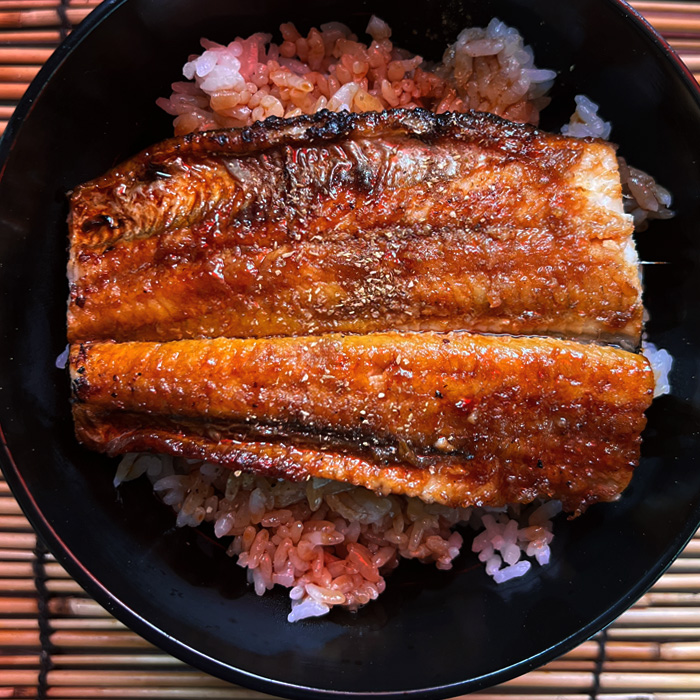
The width and height of the screenshot is (700, 700). Identify the location of 1 curve of bowl not cut off in picture. (388, 682).